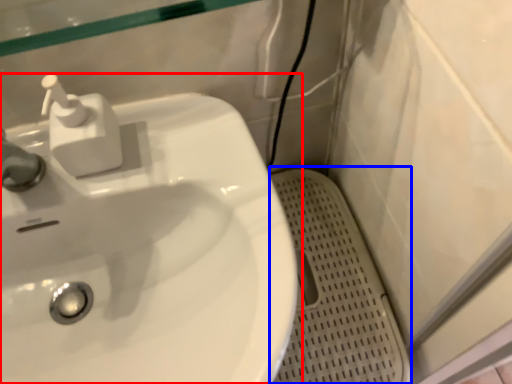
Question: Among these objects, which one is nearest to the camera, sink (highlighted by a red box) or porcelain (highlighted by a blue box)?

Choices:
 (A) sink
 (B) porcelain

Answer: (A)